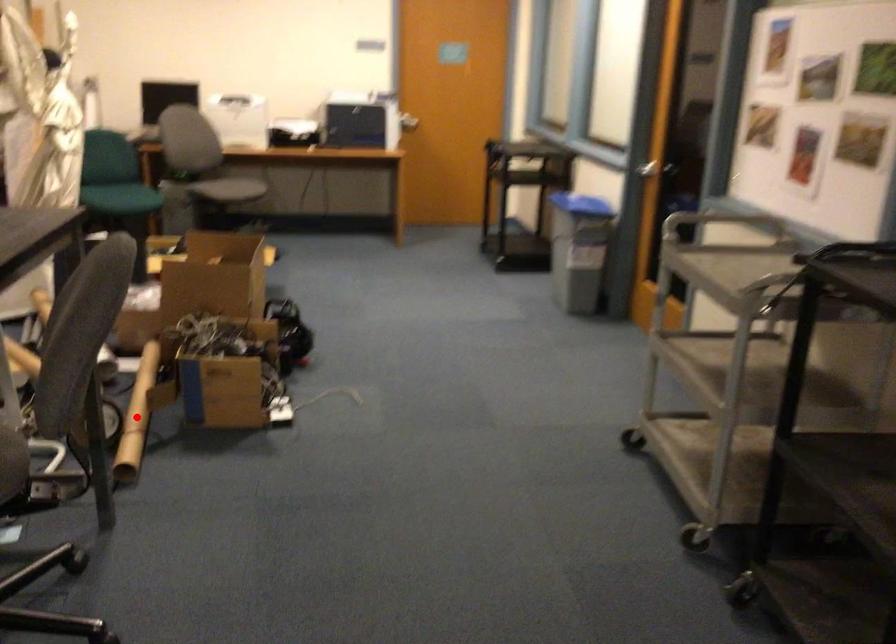
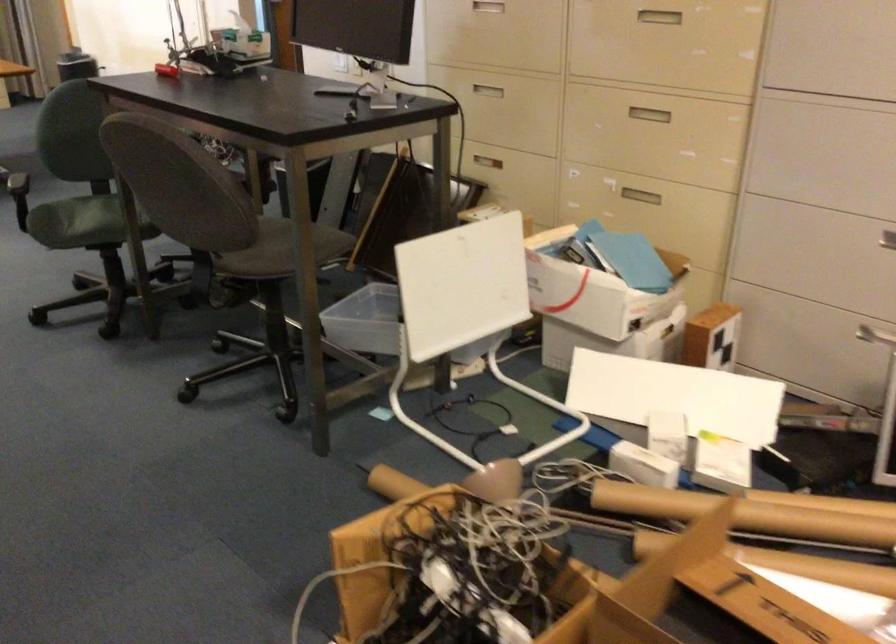
Question: I am providing you with two images of the same scene from different viewpoints. A red point is marked on the first image. At the location where the point appears in image 1, is it still visible in image 2?

Choices:
 (A) Yes
 (B) No

Answer: (B)